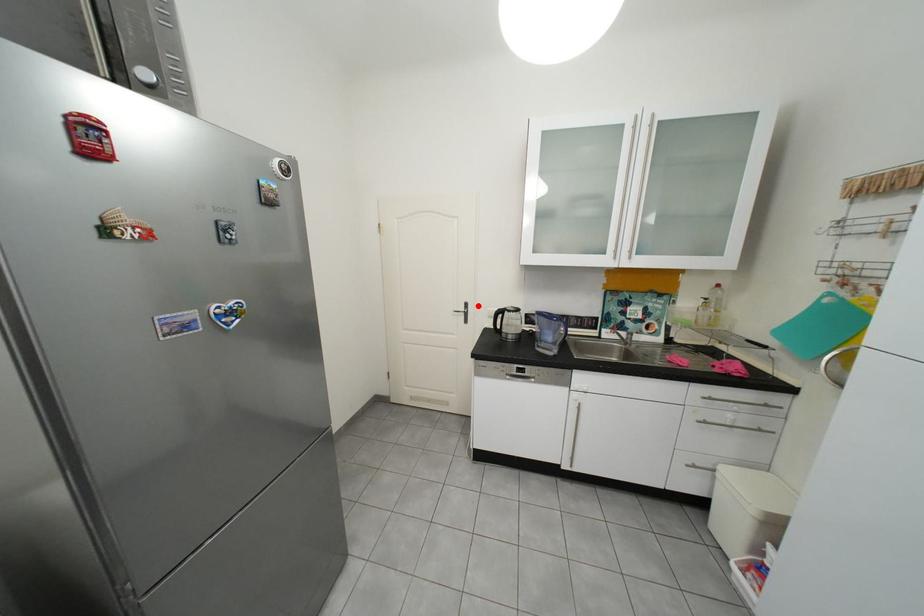
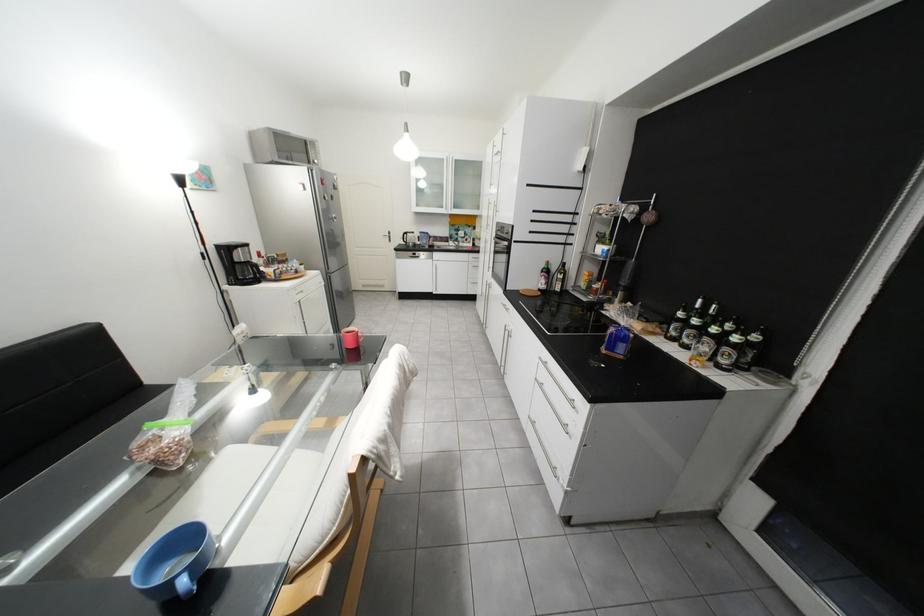
Locate, in the second image, the point that corresponds to the highlighted location in the first image.

(402, 233)